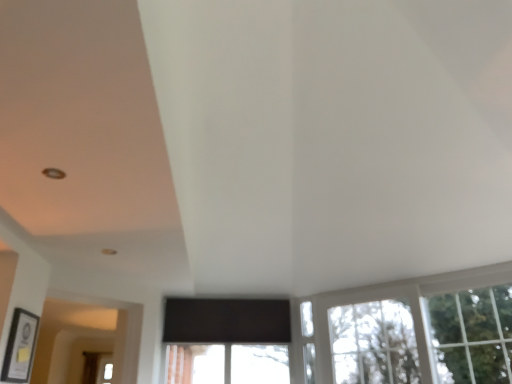
Question: Does green leafy tree at upper right have a lesser height compared to clear glass window at lower right?

Choices:
 (A) yes
 (B) no

Answer: (B)

Question: Is green leafy tree at upper right placed right next to clear glass window at lower right?

Choices:
 (A) yes
 (B) no

Answer: (B)

Question: Is green leafy tree at upper right oriented away from clear glass window at lower right?

Choices:
 (A) no
 (B) yes

Answer: (B)

Question: Is green leafy tree at upper right positioned before clear glass window at lower right?

Choices:
 (A) no
 (B) yes

Answer: (B)

Question: Is green leafy tree at upper right completely or partially outside of clear glass window at lower right?

Choices:
 (A) no
 (B) yes

Answer: (A)

Question: From the image's perspective, is clear glass window at lower right positioned above or below green leafy tree at upper right?

Choices:
 (A) below
 (B) above

Answer: (A)

Question: Looking at the image, does clear glass window at lower right seem bigger or smaller compared to green leafy tree at upper right?

Choices:
 (A) big
 (B) small

Answer: (B)

Question: Is point (386, 379) closer or farther from the camera than point (436, 342)?

Choices:
 (A) closer
 (B) farther

Answer: (B)

Question: Considering the positions of clear glass window at lower right and green leafy tree at upper right in the image, is clear glass window at lower right wider or thinner than green leafy tree at upper right?

Choices:
 (A) thin
 (B) wide

Answer: (B)

Question: Looking at their shapes, would you say clear glass window at lower right is wider or thinner than matte black picture frame at lower left?

Choices:
 (A) wide
 (B) thin

Answer: (A)

Question: In terms of size, does clear glass window at lower right appear bigger or smaller than matte black picture frame at lower left?

Choices:
 (A) small
 (B) big

Answer: (B)

Question: Considering the positions of point (375, 339) and point (31, 317), is point (375, 339) closer or farther from the camera than point (31, 317)?

Choices:
 (A) farther
 (B) closer

Answer: (A)

Question: From a real-world perspective, is clear glass window at lower right physically located above or below matte black picture frame at lower left?

Choices:
 (A) below
 (B) above

Answer: (B)

Question: Looking at the image, does green leafy tree at upper right seem bigger or smaller compared to clear glass window at lower right?

Choices:
 (A) small
 (B) big

Answer: (B)

Question: In the image, is green leafy tree at upper right on the left side or the right side of clear glass window at lower right?

Choices:
 (A) left
 (B) right

Answer: (B)